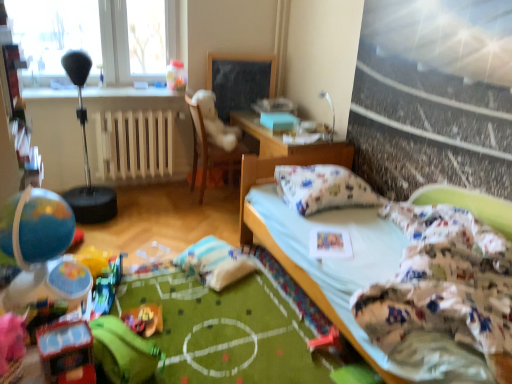
What are the coordinates of `blank space above white wooden radiator at center (from a real-world perspective)` in the screenshot? It's located at (130, 108).